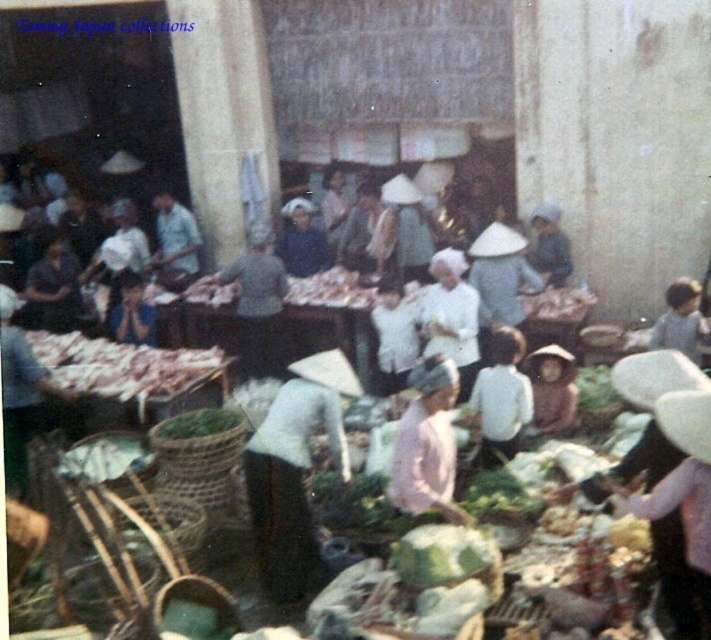
Question: Can you confirm if brown woven basket at lower left is positioned below light brown woven basket at center?

Choices:
 (A) no
 (B) yes

Answer: (B)

Question: Does white meat at center have a smaller size compared to light pink fabric hat at center?

Choices:
 (A) yes
 (B) no

Answer: (B)

Question: Considering the real-world distances, which object is farthest from the white meat at center?

Choices:
 (A) white matte child at center
 (B) white fabric hat at center
 (C) pink fabric at center

Answer: (A)

Question: Which of the following is the closest to the observer?

Choices:
 (A) brown woven basket at lower left
 (B) white meat at center
 (C) light pink fabric hat at center

Answer: (A)

Question: Which of the following is the farthest from the observer?

Choices:
 (A) (198, 625)
 (B) (95, 547)
 (C) (306, 541)
 (D) (525, 362)

Answer: (D)

Question: Observing the image, what is the correct spatial positioning of pink fabric at center in reference to light pink fabric hat at center?

Choices:
 (A) left
 (B) right

Answer: (A)